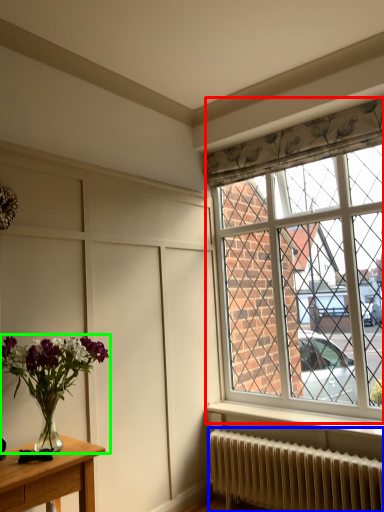
Question: Considering the real-world distances, which object is closest to window (highlighted by a red box)? radiator (highlighted by a blue box) or houseplant (highlighted by a green box).

Choices:
 (A) radiator
 (B) houseplant

Answer: (A)